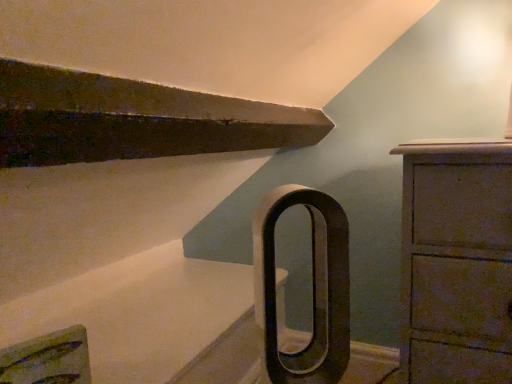
Question: Is point (505, 332) positioned closer to the camera than point (326, 220)?

Choices:
 (A) closer
 (B) farther

Answer: (B)

Question: In terms of height, does wooden chest of drawers at right look taller or shorter compared to black matte door handle at center?

Choices:
 (A) short
 (B) tall

Answer: (B)

Question: Considering the positions of wooden chest of drawers at right and black matte door handle at center in the image, is wooden chest of drawers at right wider or thinner than black matte door handle at center?

Choices:
 (A) wide
 (B) thin

Answer: (A)

Question: From the image's perspective, relative to wooden chest of drawers at right, is black matte door handle at center above or below?

Choices:
 (A) above
 (B) below

Answer: (A)

Question: In terms of height, does black matte door handle at center look taller or shorter compared to wooden chest of drawers at right?

Choices:
 (A) tall
 (B) short

Answer: (B)

Question: Would you say black matte door handle at center is to the left or to the right of wooden chest of drawers at right in the picture?

Choices:
 (A) left
 (B) right

Answer: (A)

Question: In the image, is black matte door handle at center positioned in front of or behind wooden chest of drawers at right?

Choices:
 (A) front
 (B) behind

Answer: (A)